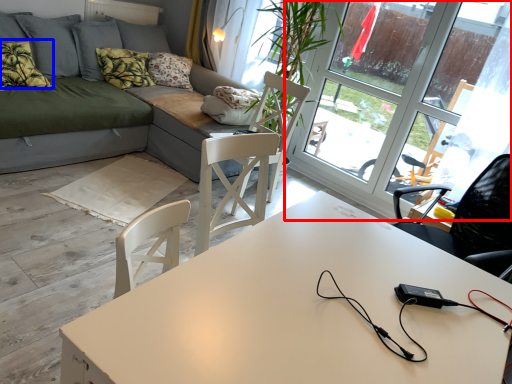
Question: Which object appears closest to the camera in this image, window (highlighted by a red box) or pillow (highlighted by a blue box)?

Choices:
 (A) window
 (B) pillow

Answer: (A)